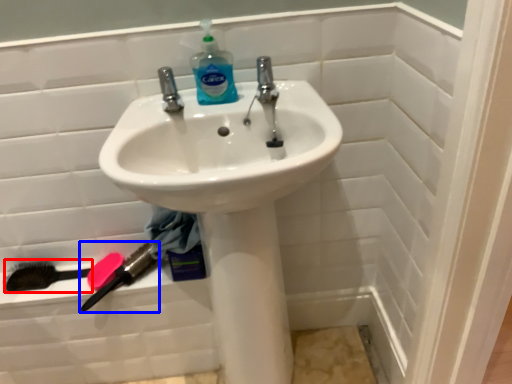
Question: Which of the following is the closest to the observer, brush (highlighted by a red box) or brush (highlighted by a blue box)?

Choices:
 (A) brush
 (B) brush

Answer: (B)